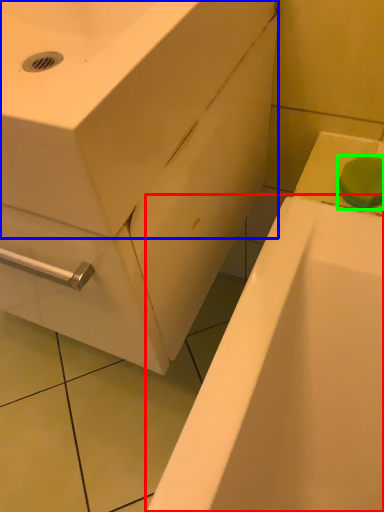
Question: Which object is the farthest from bathtub (highlighted by a red box)? Choose among these: sink (highlighted by a blue box) or soap (highlighted by a green box).

Choices:
 (A) sink
 (B) soap

Answer: (A)